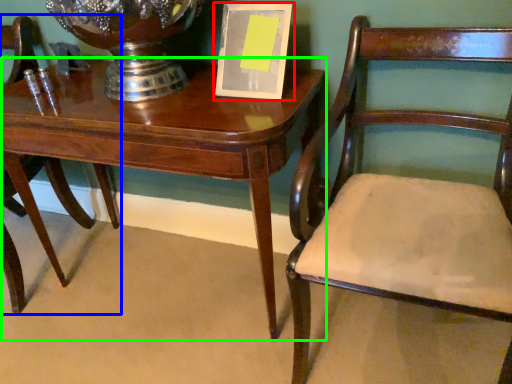
Question: Considering the real-world distances, which object is farthest from picture frame (highlighted by a red box)? chair (highlighted by a blue box) or table (highlighted by a green box)?

Choices:
 (A) chair
 (B) table

Answer: (A)